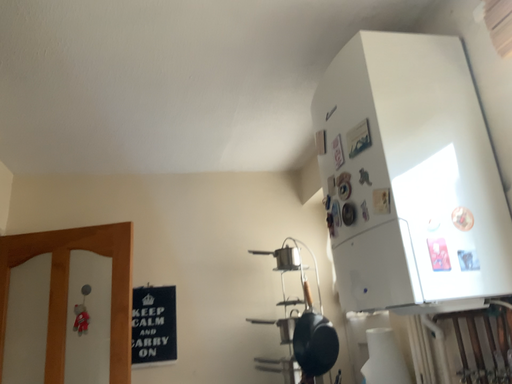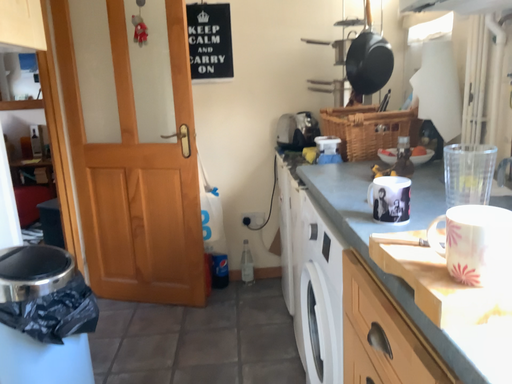
Question: How did the camera likely rotate when shooting the video?

Choices:
 (A) rotated downward
 (B) rotated upward

Answer: (A)